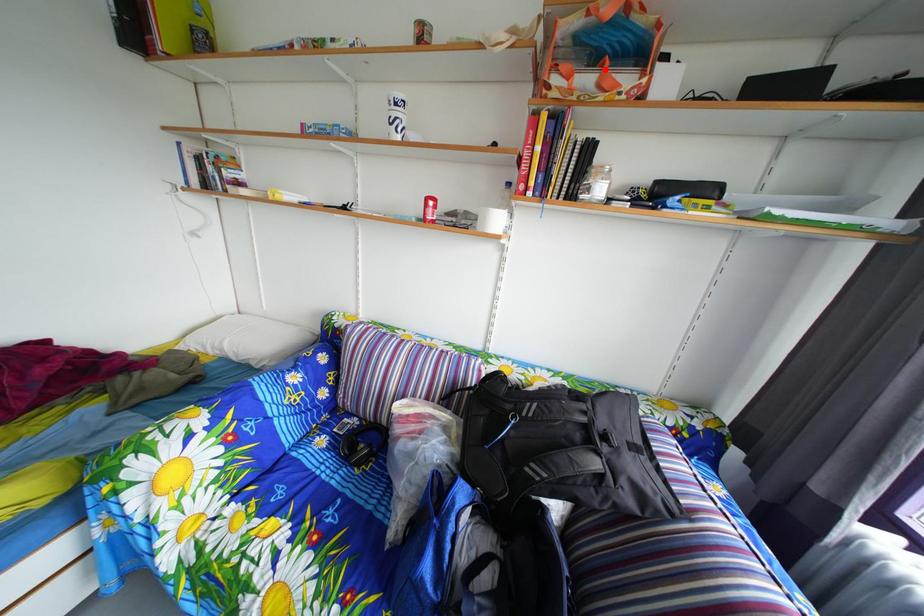
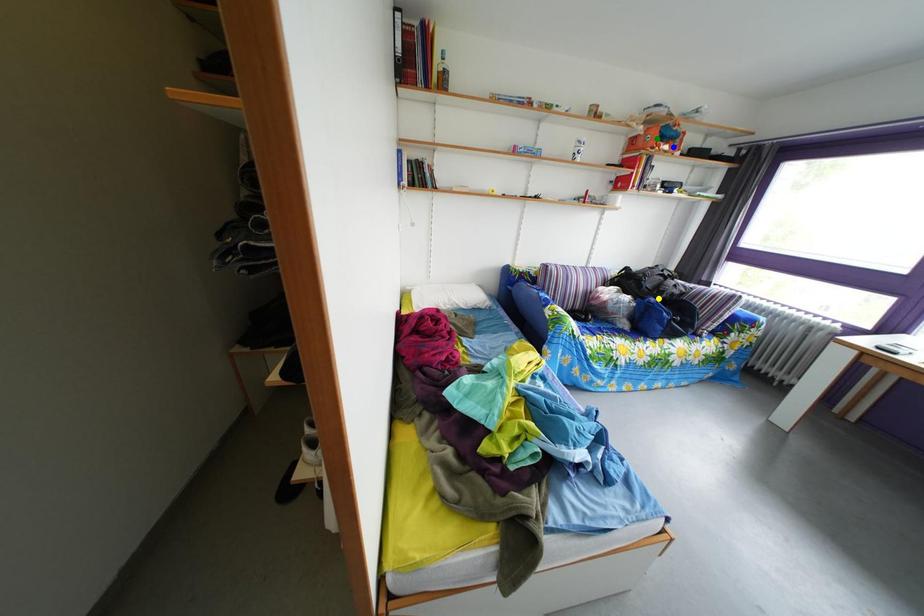
Question: I am providing you with two images of the same scene from different viewpoints. A red point is marked on the first image. You are given multiple points on the second image. Which point in image 2 is actually the same real-world point as the red point in image 1?

Choices:
 (A) blue point
 (B) green point
 (C) yellow point

Answer: (A)